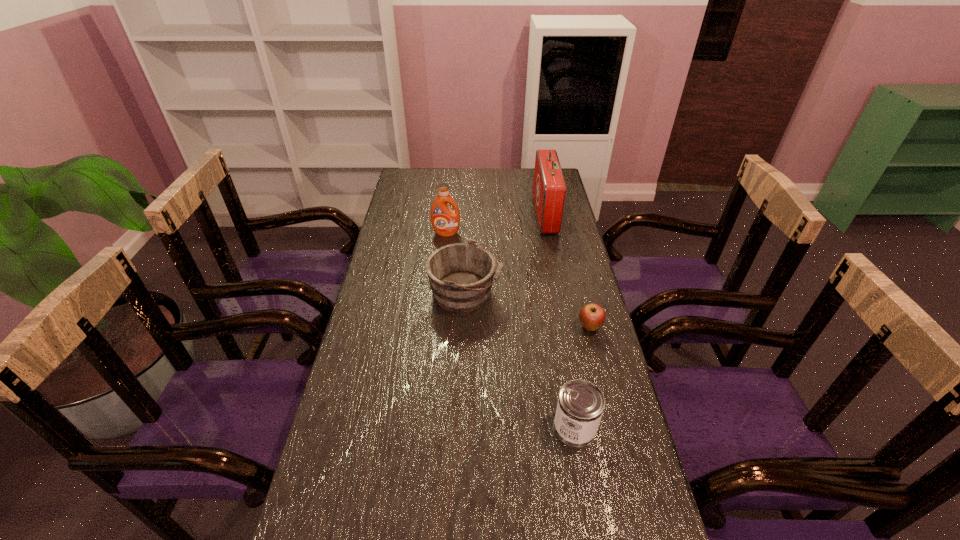
At what (x,y) coordinates should I click in order to perform the action: click on free space that satisfies the following two spatial constraints: 1. on the side of the tallest object with the first aid cross symbol; 2. on the front-facing side of the second tallest object. Please return your answer as a coordinate pair (x, y). Looking at the image, I should click on (549, 233).